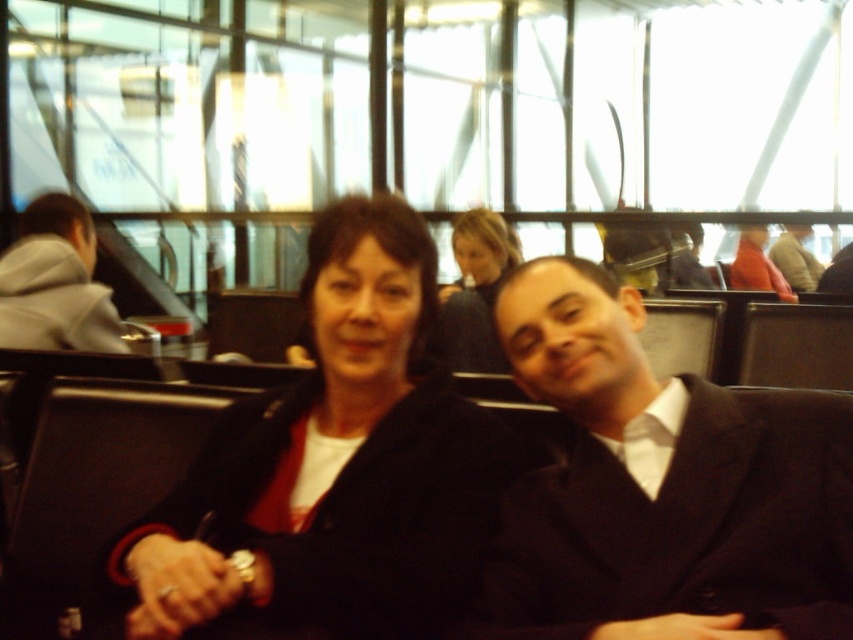
Question: Which object is closer to the camera taking this photo?

Choices:
 (A) gray hoodie at left
 (B) matte black suit at center
 (C) black matte suit at center

Answer: (C)

Question: Where is gray hoodie at left located in relation to smooth black hair at center in the image?

Choices:
 (A) right
 (B) left

Answer: (B)

Question: Observing the image, what is the correct spatial positioning of gray hoodie at left in reference to smooth black hair at center?

Choices:
 (A) left
 (B) right

Answer: (A)

Question: Which point is farther to the camera?

Choices:
 (A) (440, 604)
 (B) (186, 605)
 (C) (598, 340)
 (D) (479, 246)

Answer: (D)

Question: From the image, what is the correct spatial relationship of matte black suit at center in relation to smooth black hair at center?

Choices:
 (A) left
 (B) right

Answer: (A)

Question: Which point appears farthest from the camera in this image?

Choices:
 (A) (18, 337)
 (B) (489, 433)
 (C) (502, 547)

Answer: (A)